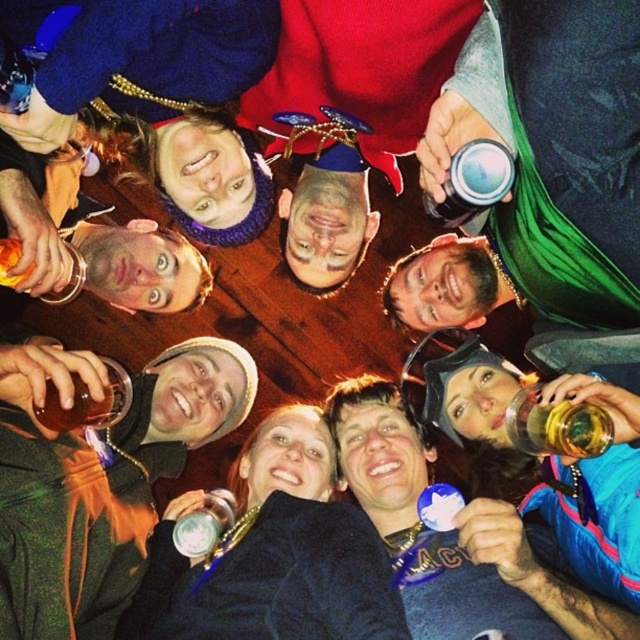
You are at a party and want to find the green fabric hat at upper center. Which direction should you look relative to the matte black jacket at lower right?

The green fabric hat at upper center is located below the matte black jacket at lower right, so you should look downward from the matte black jacket at lower right to find it.

You are a photographer standing at the front of the group. You want to take a photo of the green fabric hat at upper center so that it appears large and clear in the photo. Based on your camera settings, objects closer than 3 feet will appear blurry. Can you take the photo as planned?

The green fabric hat at upper center is 3.42 feet away from the camera. Since it is slightly beyond the 3 feet threshold, the photographer can take the photo as planned without the hat appearing blurry.

In the scene described, there is a green fabric hat at upper center located at point (x=97, y=477). Can you identify what object is positioned exactly at that coordinate?

The object at point (x=97, y=477) is the green fabric hat at upper center.